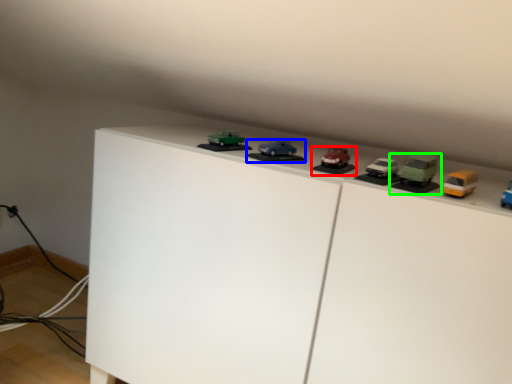
Question: Based on their relative distances, which object is farther from toy (highlighted by a red box)? Choose from toy (highlighted by a blue box) and toy (highlighted by a green box).

Choices:
 (A) toy
 (B) toy

Answer: (B)